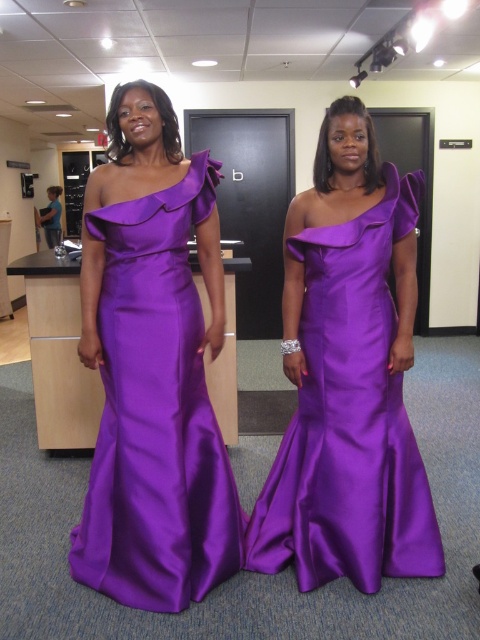
Does point (165, 445) lie in front of point (403, 531)?

Yes, it is.

Is point (211, 502) positioned behind point (384, 340)?

Yes, it is behind point (384, 340).

Measure the distance between purple satin dress at left and camera.

A distance of 1.77 meters exists between purple satin dress at left and camera.

Where is `purple satin dress at left`? The image size is (480, 640). purple satin dress at left is located at coordinates (156, 413).